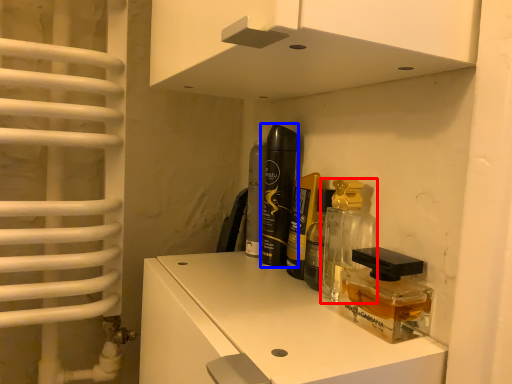
Question: Which point is closer to the camera, perfume (highlighted by a red box) or perfume (highlighted by a blue box)?

Choices:
 (A) perfume
 (B) perfume

Answer: (A)